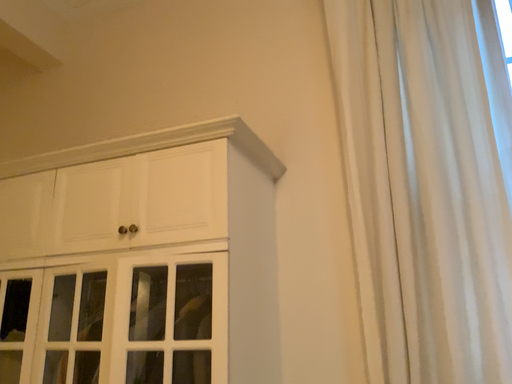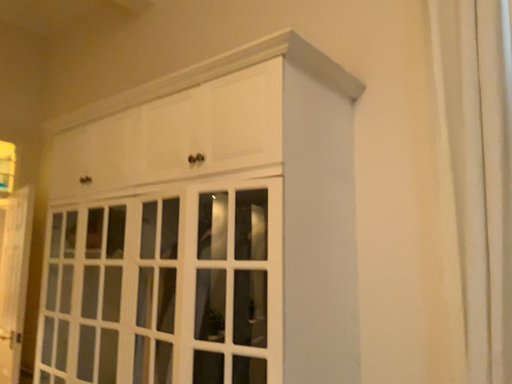
Question: Which way did the camera rotate in the video?

Choices:
 (A) rotated right
 (B) rotated left

Answer: (B)